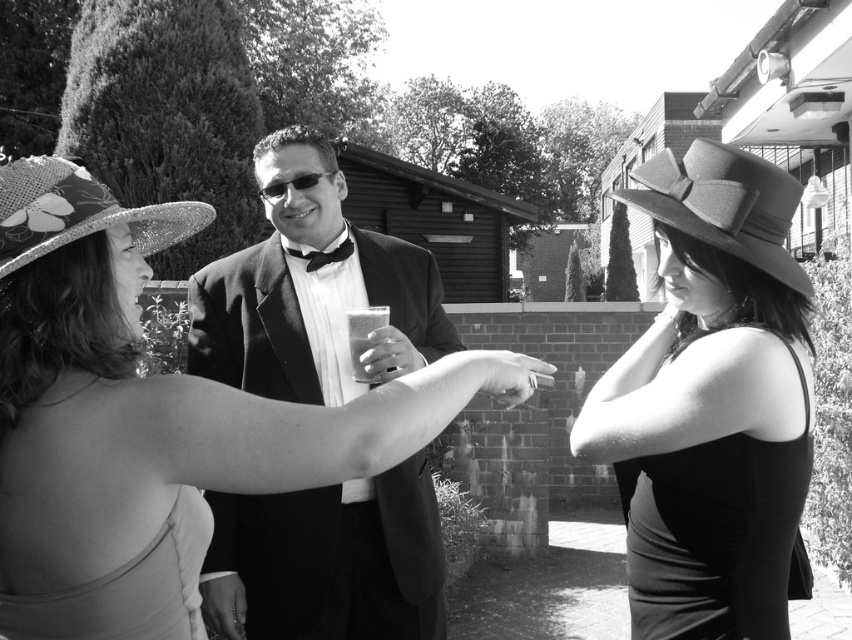
You are a photographer adjusting your camera settings to focus on the shiny fabric hat at center and the shiny black suit at center. Which object should you focus on first to ensure it appears sharp in the photo?

The shiny fabric hat at center is closer to the viewer than the shiny black suit at center, so you should focus on the shiny fabric hat at center first to ensure it appears sharp.